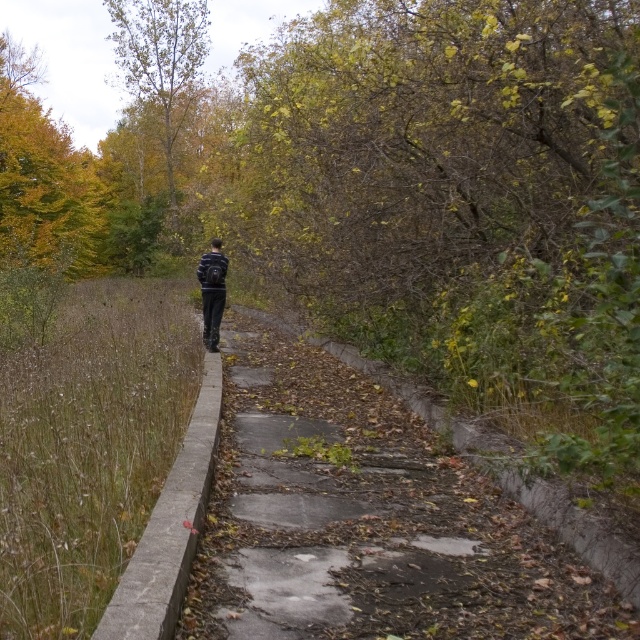
How far apart are green leafy tree at upper left and striped sweater at center?

green leafy tree at upper left and striped sweater at center are 104.41 feet apart.

Is green leafy tree at upper left wider than striped sweater at center?

Correct, the width of green leafy tree at upper left exceeds that of striped sweater at center.

Is point (154, 13) farther from viewer compared to point (209, 282)?

Yes.

At what (x,y) coordinates should I click in order to perform the action: click on green leafy tree at upper left. Please return your answer as a coordinate pair (x, y). This screenshot has height=640, width=640. Looking at the image, I should click on (161, 58).

Between striped sweater at center and dark blue fabric jacket at center, which one is positioned higher?

dark blue fabric jacket at center is higher up.

Does striped sweater at center have a greater width compared to dark blue fabric jacket at center?

Incorrect, striped sweater at center's width does not surpass dark blue fabric jacket at center's.

Find the location of a particular element. This screenshot has height=640, width=640. striped sweater at center is located at coordinates (212, 291).

Is green leafy tree at upper left further to the viewer compared to dark blue fabric jacket at center?

Yes, it is.

Can you confirm if green leafy tree at upper left is wider than dark blue fabric jacket at center?

Correct, the width of green leafy tree at upper left exceeds that of dark blue fabric jacket at center.

Who is more distant from viewer, (120, 13) or (212, 278)?

The point (120, 13) is more distant.

This screenshot has width=640, height=640. Identify the location of green leafy tree at upper left. (161, 58).